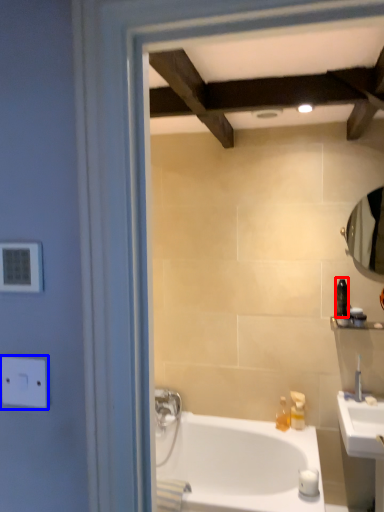
Question: Which point is closer to the camera, toiletry (highlighted by a red box) or electric outlet (highlighted by a blue box)?

Choices:
 (A) toiletry
 (B) electric outlet

Answer: (B)